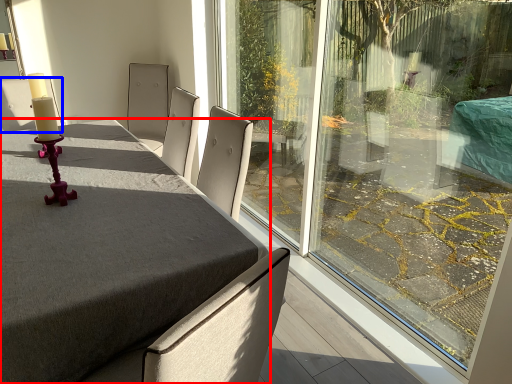
Question: Which object appears closest to the camera in this image, table (highlighted by a red box) or chair (highlighted by a blue box)?

Choices:
 (A) table
 (B) chair

Answer: (A)